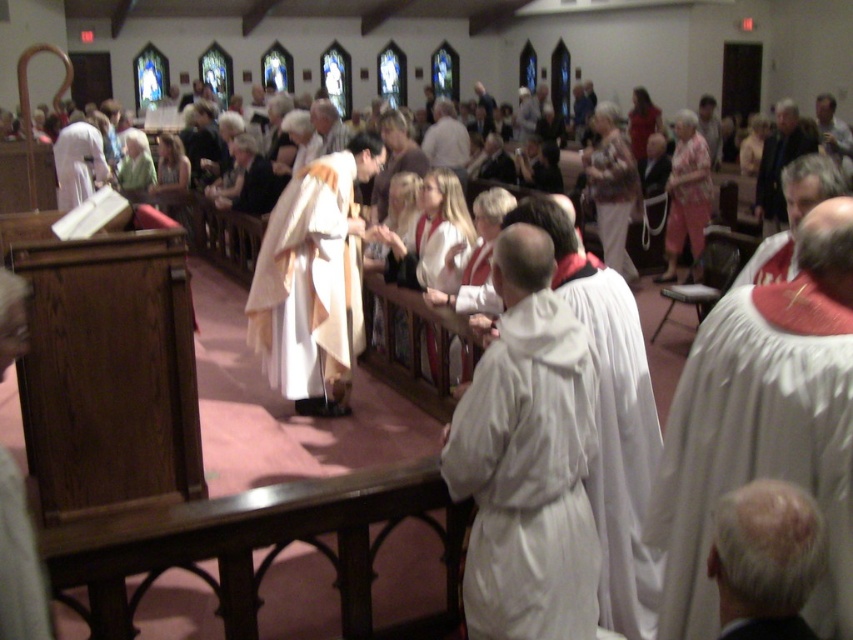
Question: Where is white clothed man at center located in relation to gray hair at upper right in the image?

Choices:
 (A) above
 (B) below

Answer: (B)

Question: Which point is farther to the camera?

Choices:
 (A) light brown leather jacket at center
 (B) light brown leather jacket at upper right
 (C) white matte robe at lower right
 (D) white clothed robe at center

Answer: (A)

Question: Does white clothed robe at center appear over floral print fabric robe at center?

Choices:
 (A) yes
 (B) no

Answer: (B)

Question: Which object is the closest to the white matte robe at lower right?

Choices:
 (A) white clothed robe at center
 (B) floral print fabric robe at center

Answer: (A)

Question: Which of the following is the farthest from the observer?

Choices:
 (A) (740, 545)
 (B) (787, 228)

Answer: (B)

Question: Is white cloth robe at center below light brown leather jacket at upper right?

Choices:
 (A) yes
 (B) no

Answer: (A)